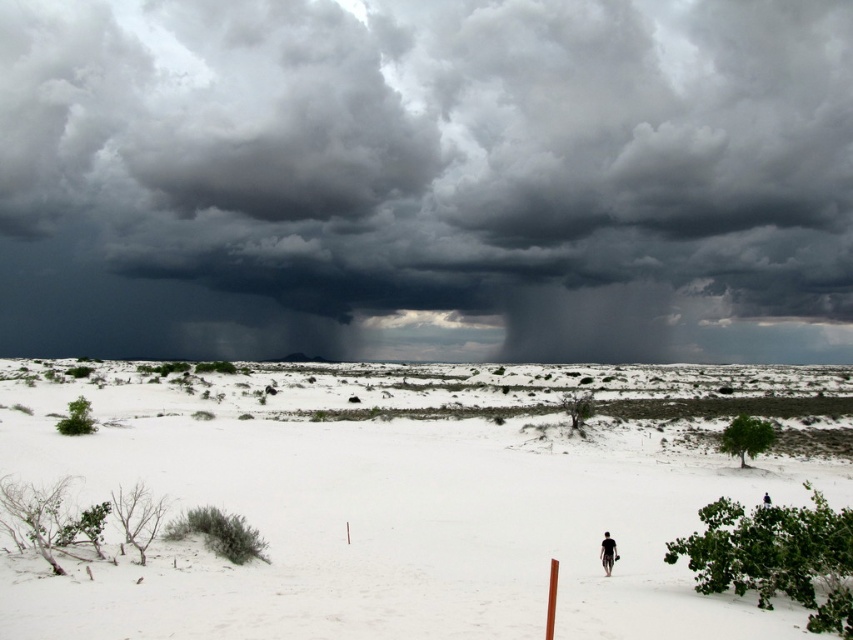
Is point (793, 92) more distant than point (250, 474)?

Yes, it is behind point (250, 474).

Find the location of a particular element. The image size is (853, 640). dark gray cloud at upper center is located at coordinates (427, 179).

Find the location of a particular element. white sand plain at center is located at coordinates (381, 516).

Does white sand plain at center have a greater height compared to black matte person at lower center?

Correct, white sand plain at center is much taller as black matte person at lower center.

What do you see at coordinates (381, 516) in the screenshot? I see `white sand plain at center` at bounding box center [381, 516].

This screenshot has width=853, height=640. I want to click on white sand plain at center, so click(381, 516).

Can you confirm if dark gray cloud at upper center is thinner than black matte person at lower center?

In fact, dark gray cloud at upper center might be wider than black matte person at lower center.

Is dark gray cloud at upper center positioned behind black matte person at lower center?

Yes, it is.

Is point (811, 77) less distant than point (608, 572)?

That is False.

Find the location of a particular element. dark gray cloud at upper center is located at coordinates (427, 179).